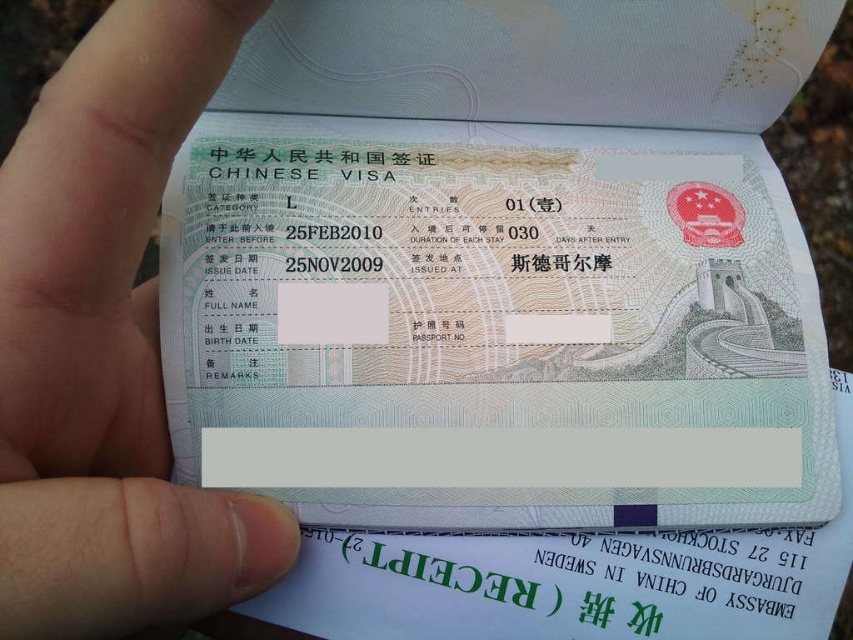
Question: Is light green paper visa at center bigger than white matte paper at lower left?

Choices:
 (A) yes
 (B) no

Answer: (A)

Question: Which point is farther to the camera?

Choices:
 (A) (349, 336)
 (B) (62, 602)

Answer: (A)

Question: In this image, where is light green paper visa at center located relative to white matte paper at lower left?

Choices:
 (A) left
 (B) right

Answer: (B)

Question: Can you confirm if light green paper visa at center is positioned above white matte paper at lower left?

Choices:
 (A) no
 (B) yes

Answer: (B)